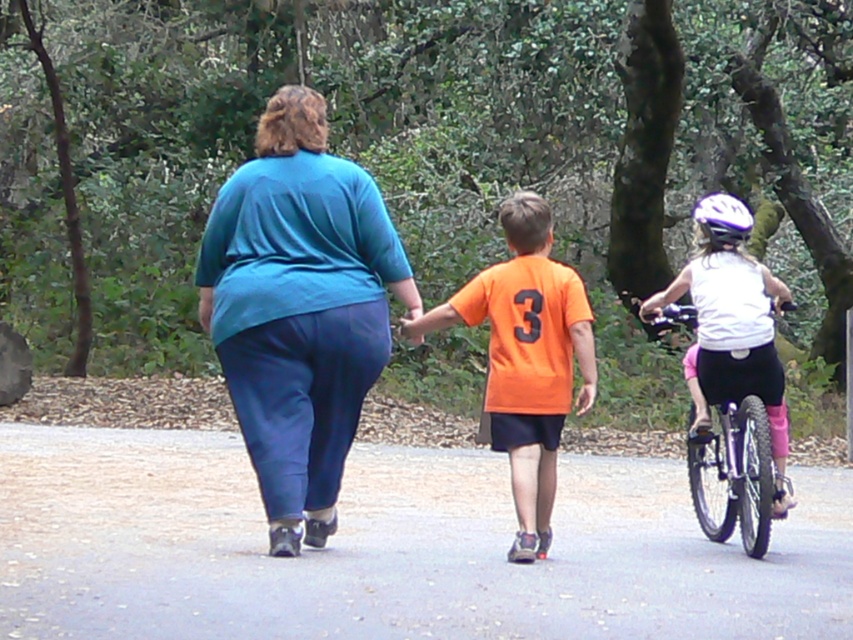
Question: Is gray asphalt road at center positioned in front of white matte bicycle helmet at upper center?

Choices:
 (A) no
 (B) yes

Answer: (A)

Question: Does gray asphalt road at center appear on the right side of orange matte shirt at center?

Choices:
 (A) yes
 (B) no

Answer: (B)

Question: Does teal fabric blouse at center appear under white matte bicycle helmet at upper center?

Choices:
 (A) yes
 (B) no

Answer: (A)

Question: Which of these objects is positioned farthest from the gray asphalt road at center?

Choices:
 (A) white matte bicycle helmet at upper center
 (B) white matte bicycle at right
 (C) orange matte shirt at center
 (D) teal fabric blouse at center

Answer: (A)

Question: Which object is farther from the camera taking this photo?

Choices:
 (A) orange matte shirt at center
 (B) white matte bicycle helmet at upper center
 (C) teal fabric blouse at center

Answer: (B)

Question: Which point is closer to the camera taking this photo?

Choices:
 (A) (729, 244)
 (B) (546, 372)

Answer: (B)